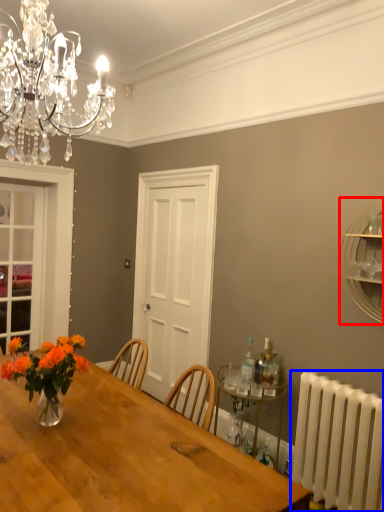
Question: Which point is closer to the camera, shelf (highlighted by a red box) or radiator (highlighted by a blue box)?

Choices:
 (A) shelf
 (B) radiator

Answer: (B)